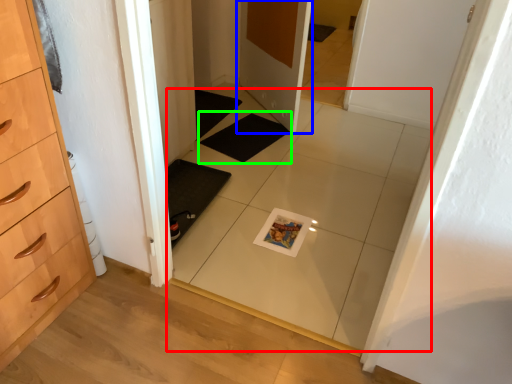
Question: Considering the real-world distances, which object is closest to tile (highlighted by a red box)? door (highlighted by a blue box) or bath mat (highlighted by a green box).

Choices:
 (A) door
 (B) bath mat

Answer: (B)